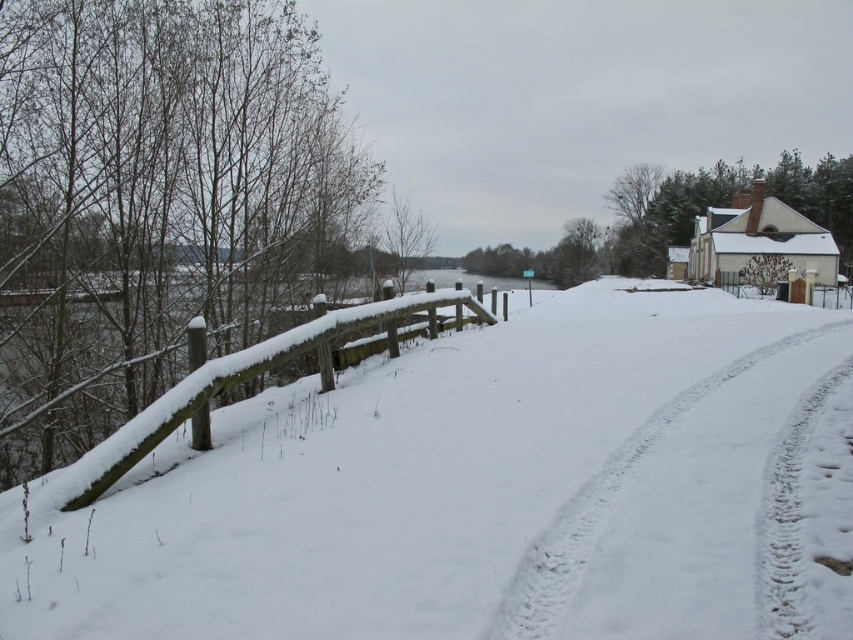
Question: Does white snow path at center appear under snow-covered wooden rail at left?

Choices:
 (A) no
 (B) yes

Answer: (B)

Question: Considering the relative positions of white snow path at center and snow-covered wooden rail at left in the image provided, where is white snow path at center located with respect to snow-covered wooden rail at left?

Choices:
 (A) below
 (B) above

Answer: (A)

Question: Does white snow path at center have a smaller size compared to snow-covered wooden rail at left?

Choices:
 (A) no
 (B) yes

Answer: (B)

Question: Which point is closer to the camera taking this photo?

Choices:
 (A) (143, 422)
 (B) (579, 577)

Answer: (B)

Question: Which of the following is the closest to the observer?

Choices:
 (A) snow-covered wooden rail at left
 (B) white snow path at center

Answer: (B)

Question: Which point is closer to the camera?

Choices:
 (A) white snow path at center
 (B) snow-covered wooden rail at left

Answer: (A)